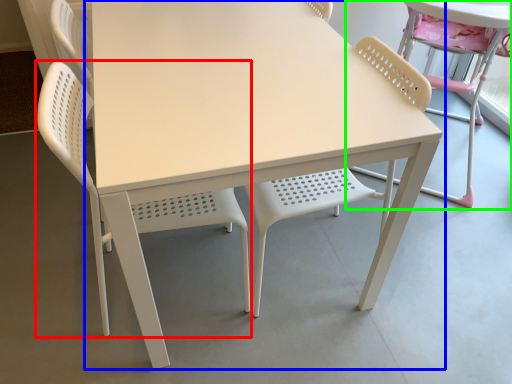
Question: Considering the real-world distances, which object is closest to chair (highlighted by a red box)? table (highlighted by a blue box) or chair (highlighted by a green box).

Choices:
 (A) table
 (B) chair

Answer: (A)